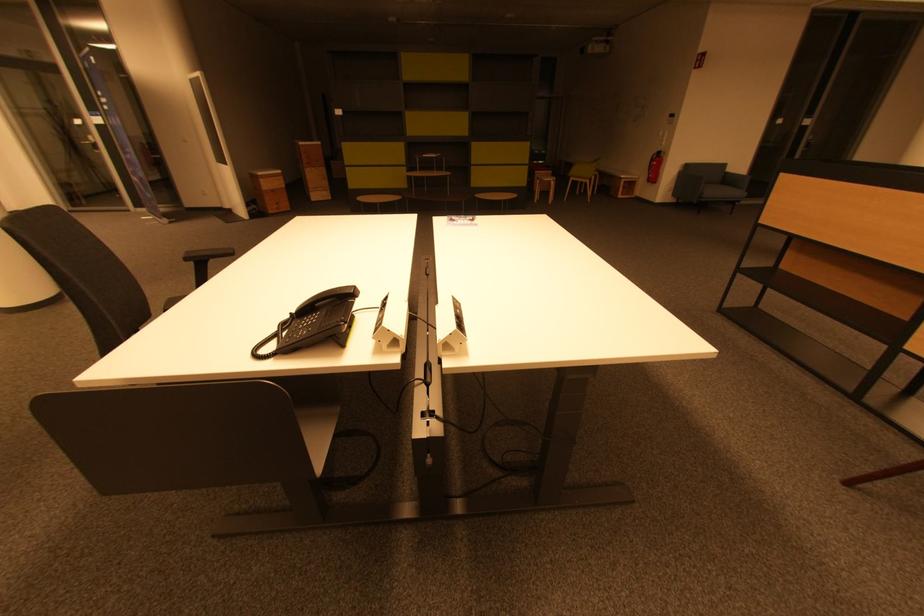
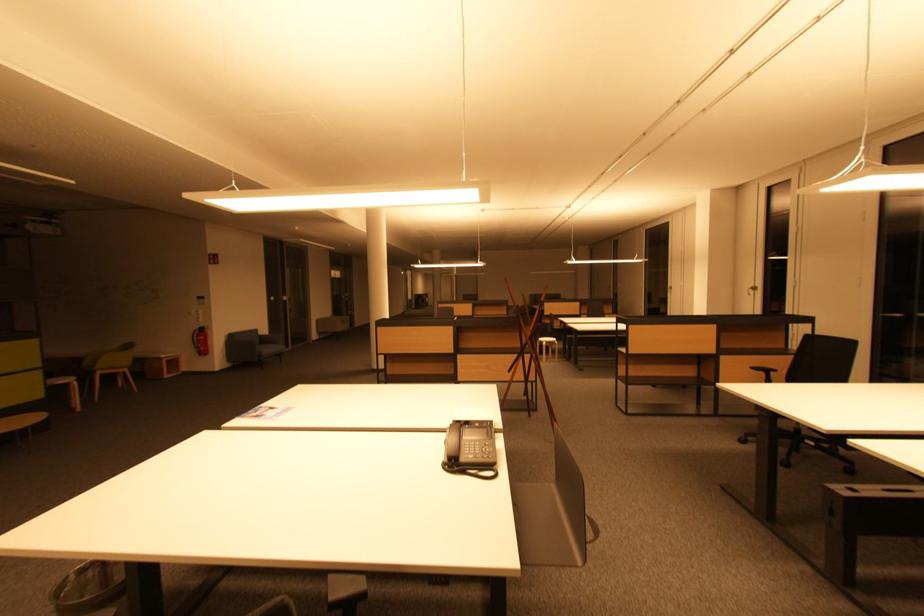
Find the pixel in the second image that matches (574,180) in the first image.

(98, 374)